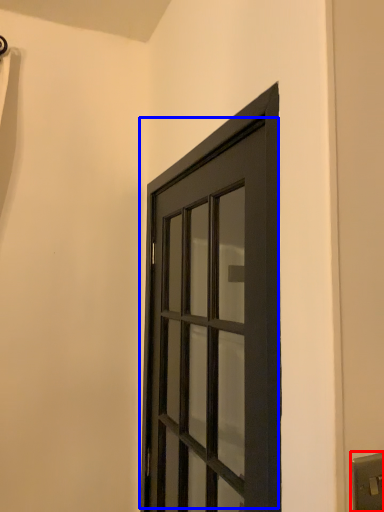
Question: Among these objects, which one is farthest to the camera, light switch (highlighted by a red box) or door (highlighted by a blue box)?

Choices:
 (A) light switch
 (B) door

Answer: (B)